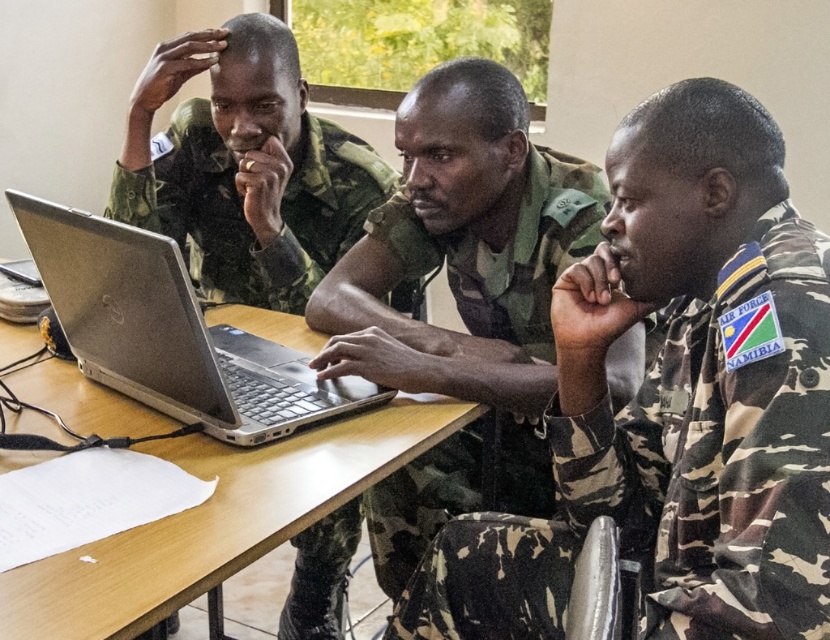
Question: Is camouflage fabric uniform at center positioned at the back of wooden table at center?

Choices:
 (A) no
 (B) yes

Answer: (B)

Question: Which point is closer to the camera?

Choices:
 (A) silver metallic laptop at center
 (B) wooden table at center
 (C) camouflage fabric uniform at center
 (D) camouflage uniform at center

Answer: (B)

Question: Which object is closer to the camera taking this photo?

Choices:
 (A) camouflage fabric uniform at center
 (B) silver metallic laptop at center
 (C) camouflage uniform at center

Answer: (A)

Question: Which of these objects is positioned farthest from the matte green uniform at upper left?

Choices:
 (A) silver metallic laptop at center
 (B) wooden table at center
 (C) camouflage fabric uniform at center
 (D) camouflage uniform at center

Answer: (C)

Question: Is camouflage fabric uniform at center below camouflage uniform at center?

Choices:
 (A) yes
 (B) no

Answer: (A)

Question: Is wooden table at center wider than matte green uniform at upper left?

Choices:
 (A) yes
 (B) no

Answer: (A)